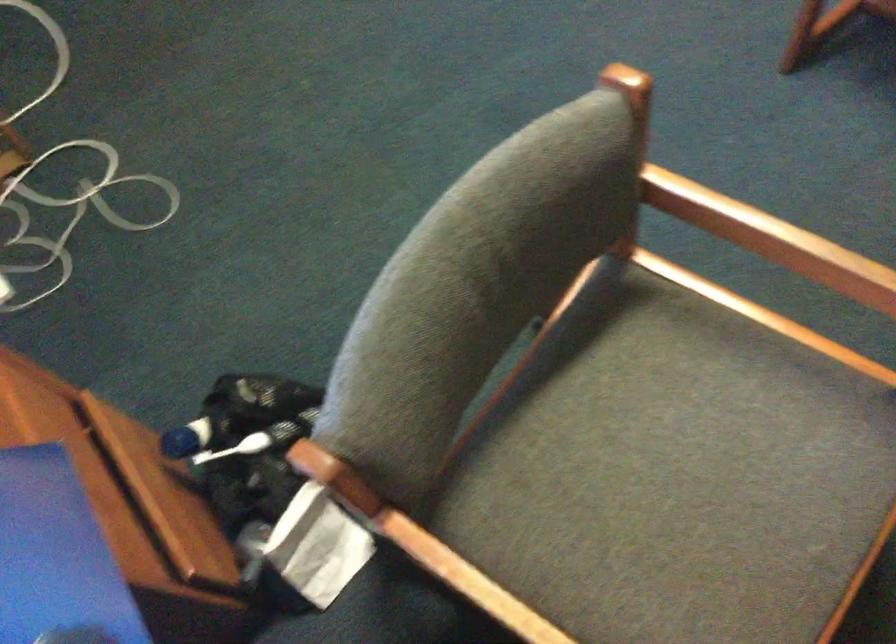
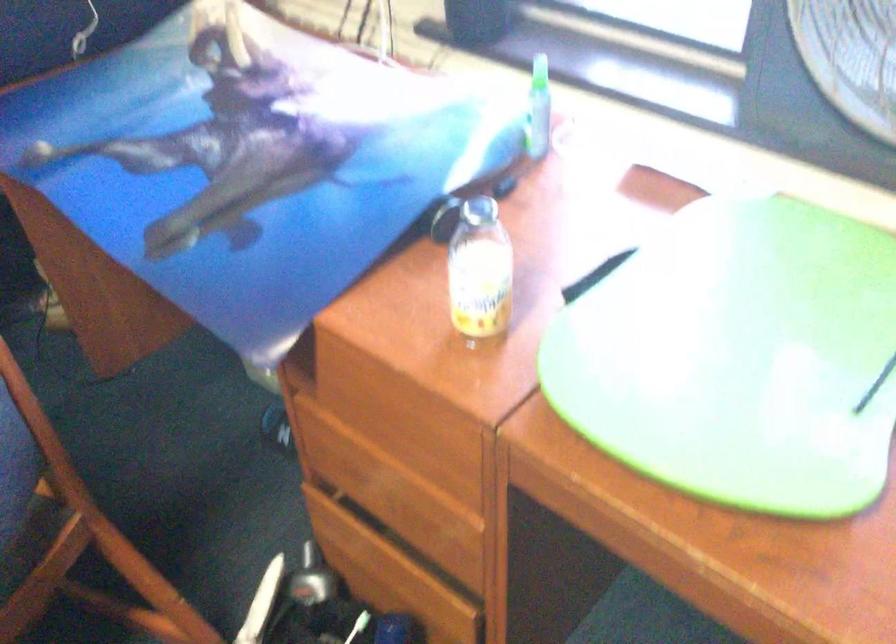
Where in the second image is the point corresponding to point 470,525 from the first image?

(30, 540)